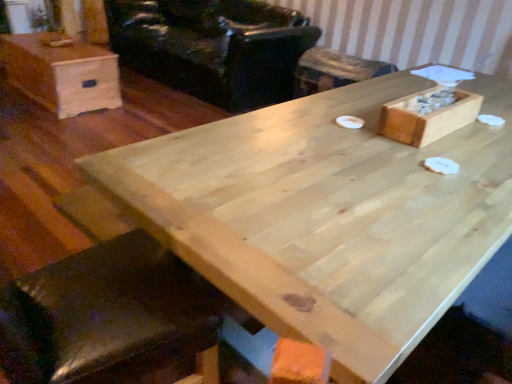
Where is `free space in front of wooden box at upper right`? The width and height of the screenshot is (512, 384). free space in front of wooden box at upper right is located at coordinates (445, 162).